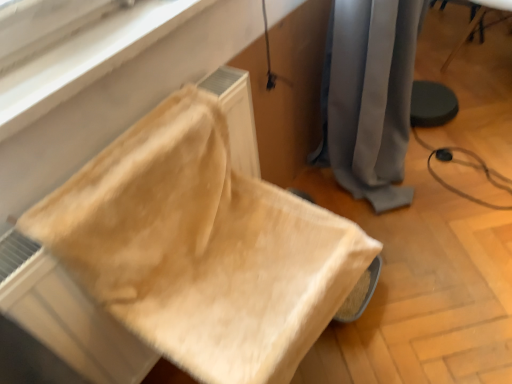
Question: Can you confirm if gray fabric curtain at center is shorter than beige fabric cushion at lower left, which is the 1th furniture in front-to-back order?

Choices:
 (A) no
 (B) yes

Answer: (A)

Question: Could you tell me if gray fabric curtain at center is facing beige fabric cushion at lower left, the second furniture positioned from the right?

Choices:
 (A) no
 (B) yes

Answer: (A)

Question: Does gray fabric curtain at center have a smaller size compared to beige fabric cushion at lower left, the second furniture positioned from the right?

Choices:
 (A) no
 (B) yes

Answer: (A)

Question: From a real-world perspective, does gray fabric curtain at center sit lower than beige fabric cushion at lower left, the 1th furniture when ordered from bottom to top?

Choices:
 (A) yes
 (B) no

Answer: (A)

Question: Are gray fabric curtain at center and beige fabric cushion at lower left, the second furniture positioned from the right, beside each other?

Choices:
 (A) no
 (B) yes

Answer: (A)

Question: Can you confirm if gray fabric curtain at center is bigger than beige fabric cushion at lower left, the 1th furniture when ordered from bottom to top?

Choices:
 (A) yes
 (B) no

Answer: (A)

Question: From the image's perspective, is gray fabric curtain at center located above wooden chair at lower right, the 2th furniture positioned from the bottom?

Choices:
 (A) no
 (B) yes

Answer: (A)

Question: From a real-world perspective, is gray fabric curtain at center located beneath wooden chair at lower right, positioned as the second furniture in front-to-back order?

Choices:
 (A) no
 (B) yes

Answer: (A)

Question: Is the position of gray fabric curtain at center less distant than that of wooden chair at lower right, the 1th furniture in the back-to-front sequence?

Choices:
 (A) no
 (B) yes

Answer: (B)

Question: Does gray fabric curtain at center appear on the left side of wooden chair at lower right, arranged as the first furniture when viewed from the top?

Choices:
 (A) yes
 (B) no

Answer: (A)

Question: From a real-world perspective, is gray fabric curtain at center positioned over wooden chair at lower right, the first furniture when ordered from right to left, based on gravity?

Choices:
 (A) yes
 (B) no

Answer: (A)

Question: Would you say wooden chair at lower right, placed as the second furniture when sorted from left to right, is part of gray fabric curtain at center's contents?

Choices:
 (A) yes
 (B) no

Answer: (B)

Question: Does beige fabric cushion at lower left, which is the 1th furniture in front-to-back order, have a greater width compared to gray fabric curtain at center?

Choices:
 (A) yes
 (B) no

Answer: (A)